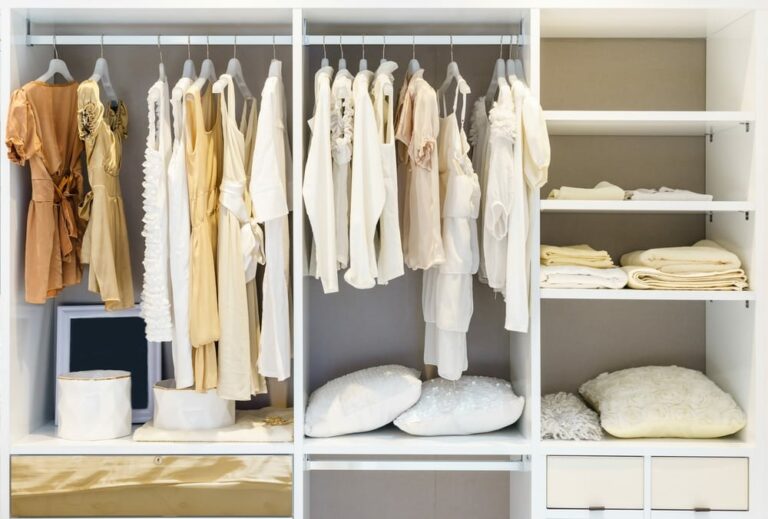
The image size is (768, 519). I want to click on towels, so click(670, 263), click(654, 271), click(601, 273), click(590, 259), click(659, 195), click(610, 192).